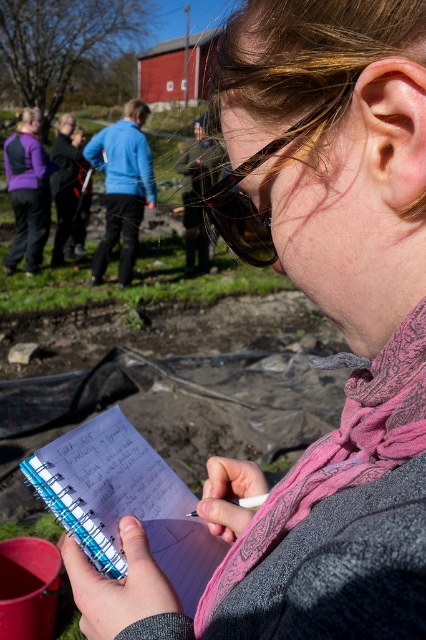
From the picture: Does black plastic goggles at center lie in front of matte purple jacket at left?

Yes, black plastic goggles at center is closer to the viewer.

Is black plastic goggles at center bigger than matte purple jacket at left?

Incorrect, black plastic goggles at center is not larger than matte purple jacket at left.

Between point (330, 118) and point (51, 163), which one is positioned in front?

Point (330, 118) is in front.

Locate an element on the screen. black plastic goggles at center is located at coordinates (250, 196).

Between pink fabric scarf at lower center and matte purple jacket at left, which one is positioned lower?

pink fabric scarf at lower center is lower down.

Looking at this image, who is more distant from viewer, (357, 432) or (17, 225)?

Point (17, 225)

Locate an element on the screen. The height and width of the screenshot is (640, 426). pink fabric scarf at lower center is located at coordinates (339, 451).

This screenshot has width=426, height=640. I want to click on pink fabric scarf at lower center, so click(x=339, y=451).

Is blue spiral notebook at lower center positioned behind matte purple jacket at left?

No, it is in front of matte purple jacket at left.

Measure the distance between blue spiral notebook at lower center and matte purple jacket at left.

blue spiral notebook at lower center and matte purple jacket at left are 5.98 meters apart from each other.

I want to click on blue spiral notebook at lower center, so click(124, 500).

Locate an element on the screen. The width and height of the screenshot is (426, 640). blue spiral notebook at lower center is located at coordinates (124, 500).